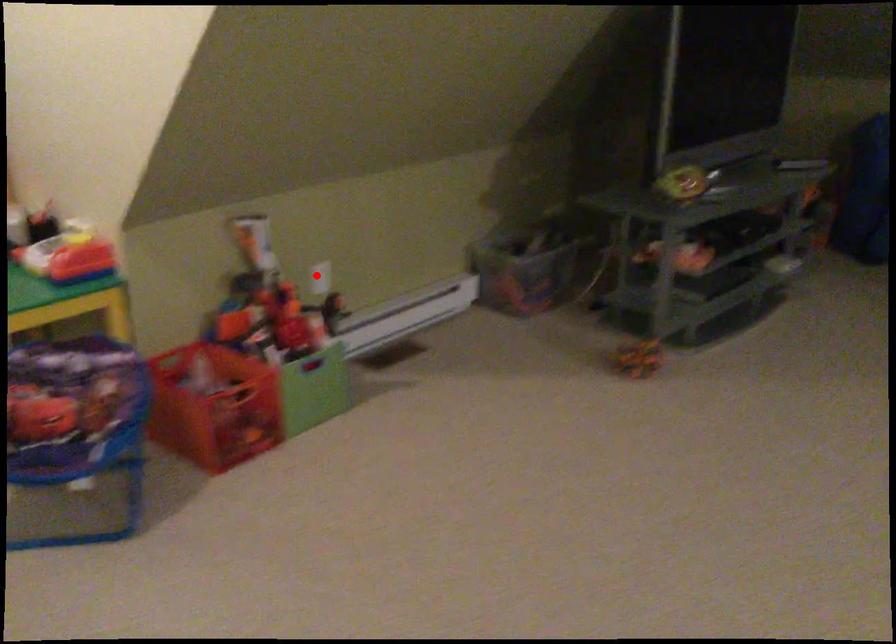
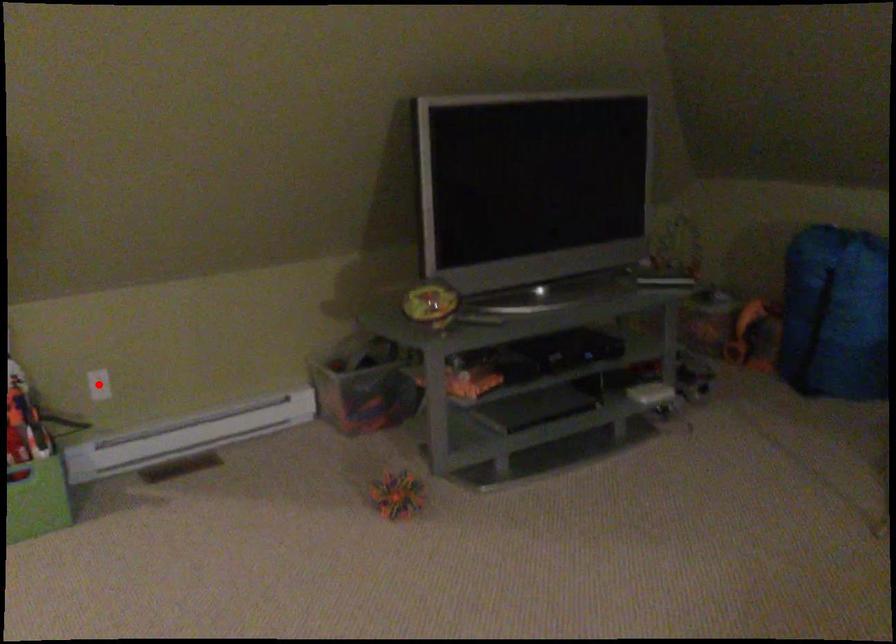
I am providing you with two images of the same scene from different viewpoints. A red point is marked on the first image and another point is marked on the second image. Does the point marked in image1 correspond to the same location as the one in image2?

Yes